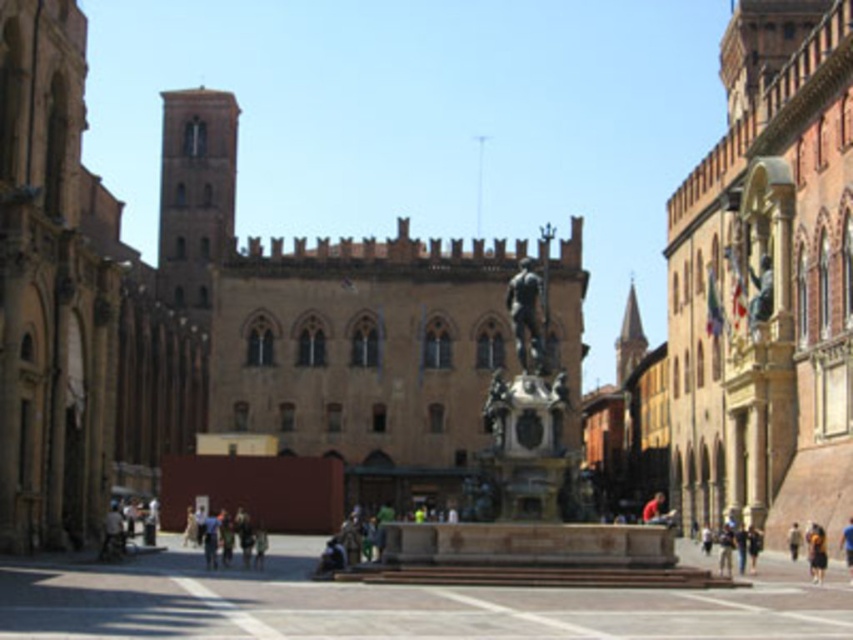
Question: Does brown stone bell tower at upper left come in front of polished bronze statue at center?

Choices:
 (A) no
 (B) yes

Answer: (A)

Question: Is polished bronze statue at center positioned before blue fabric person at center?

Choices:
 (A) yes
 (B) no

Answer: (B)

Question: Which object appears closest to the camera in this image?

Choices:
 (A) polished bronze statue at center
 (B) brown leather jacket at center

Answer: (B)

Question: Does brown stone bell tower at upper left come in front of brown leather jacket at center?

Choices:
 (A) no
 (B) yes

Answer: (A)

Question: Which object appears farthest from the camera in this image?

Choices:
 (A) blue fabric person at center
 (B) brown leather jacket at center
 (C) polished bronze statue at center

Answer: (C)

Question: Among these points, which one is farthest from the camera?

Choices:
 (A) (512, 301)
 (B) (811, 554)

Answer: (A)